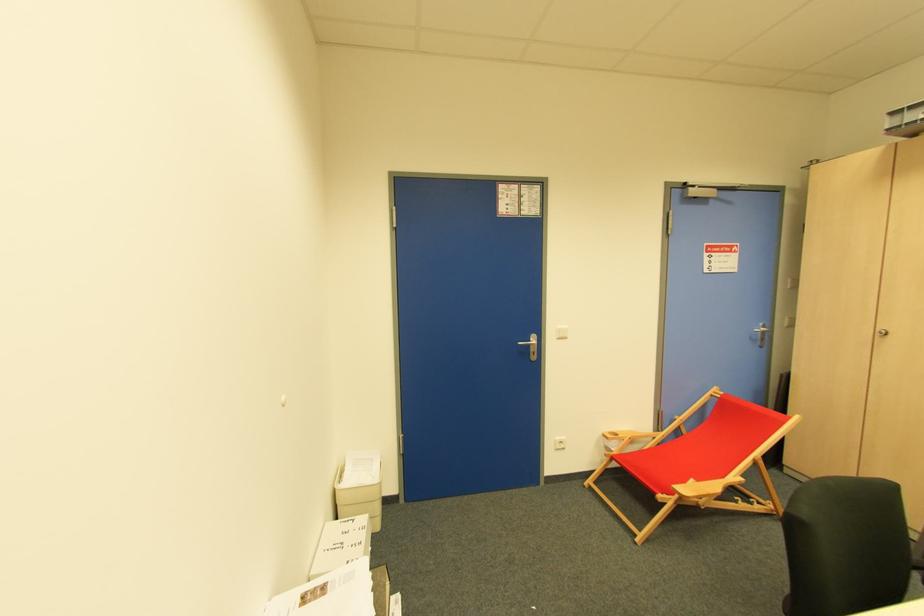
The height and width of the screenshot is (616, 924). What are the coordinates of `red chair sitting surface` in the screenshot? It's located at (696, 456).